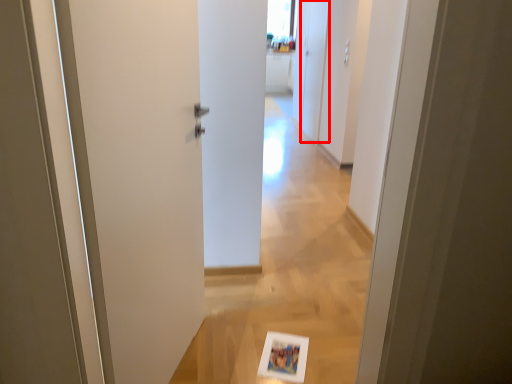
Question: Where is screen door (annotated by the red box) located in relation to door in the image?

Choices:
 (A) left
 (B) right

Answer: (B)